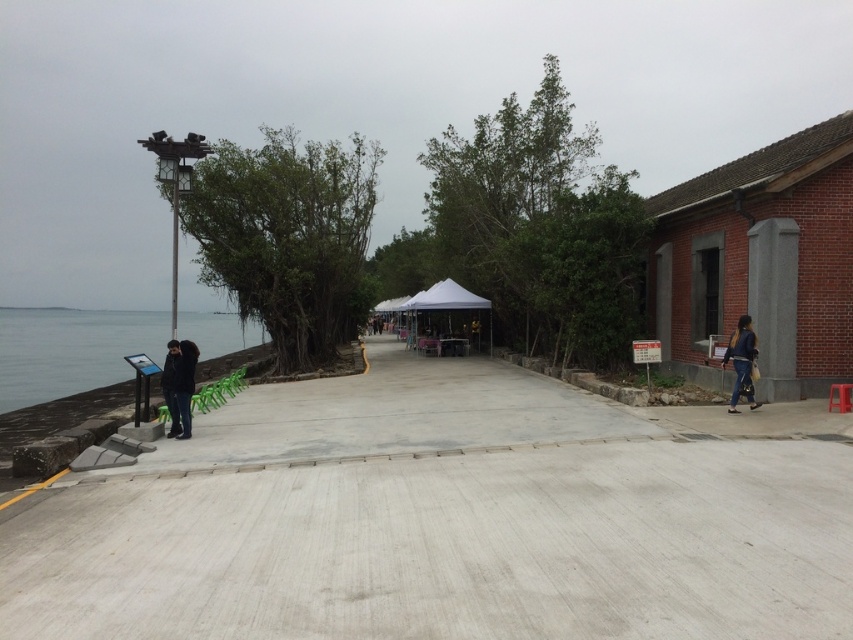
Question: Can you confirm if gray concrete pavement at center is wider than gray concrete path at center?

Choices:
 (A) no
 (B) yes

Answer: (B)

Question: Is the position of clear water at lower left less distant than that of dark blue jeans at right?

Choices:
 (A) yes
 (B) no

Answer: (B)

Question: Which point appears farthest from the camera in this image?

Choices:
 (A) tap(189, 323)
 (B) tap(738, 381)
 (C) tap(334, 429)
 (D) tap(838, 557)

Answer: (A)

Question: Which of the following is the farthest from the observer?

Choices:
 (A) (173, 432)
 (B) (732, 394)

Answer: (B)

Question: Does gray concrete pavement at center appear on the right side of gray concrete path at center?

Choices:
 (A) no
 (B) yes

Answer: (B)

Question: Which object is closer to the camera taking this photo?

Choices:
 (A) gray concrete path at center
 (B) dark blue jacket at left
 (C) gray concrete pavement at center
 (D) dark blue jeans at right

Answer: (C)